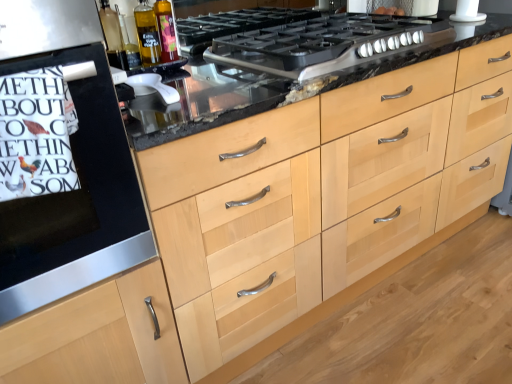
Where is `white matte plastic pipe at upper right, which ranks as the 1th appliance in back-to-front order`? This screenshot has height=384, width=512. white matte plastic pipe at upper right, which ranks as the 1th appliance in back-to-front order is located at coordinates (467, 12).

Describe the element at coordinates (166, 31) in the screenshot. I see `translucent glass bottle at upper left, which is the first bottle from right to left` at that location.

Describe the element at coordinates (147, 34) in the screenshot. I see `translucent glass bottle at upper center, the first bottle in the left-to-right sequence` at that location.

Identify the location of black matte oven at left. The height and width of the screenshot is (384, 512). (62, 159).

Identify the location of white matte plastic pipe at upper right, the 2th appliance positioned from the bottom. (467, 12).

Does translucent glass bottle at upper left, the second bottle in the left-to-right sequence, turn towards white plastic juicer at center, the first appliance in the front-to-back sequence?

No, translucent glass bottle at upper left, the second bottle in the left-to-right sequence, is not aimed at white plastic juicer at center, the first appliance in the front-to-back sequence.

Is point (170, 26) closer to camera compared to point (137, 96)?

No, (170, 26) is further to viewer.

Find the location of a particular element. appliance below the translucent glass bottle at upper left, which is the first bottle from right to left (from a real-world perspective) is located at coordinates (x=153, y=87).

Considering their positions, is translucent glass bottle at upper left, the second bottle in the left-to-right sequence, located in front of or behind white plastic juicer at center, which appears as the second appliance when viewed from the top?

Clearly, translucent glass bottle at upper left, the second bottle in the left-to-right sequence, is behind white plastic juicer at center, which appears as the second appliance when viewed from the top.

Does point (38, 188) come in front of point (158, 37)?

Yes, point (38, 188) is closer to viewer.

Is white paper towel at left spatially inside translucent glass bottle at upper center, which appears as the 2th bottle when viewed from the right, or outside of it?

white paper towel at left exists outside the volume of translucent glass bottle at upper center, which appears as the 2th bottle when viewed from the right.

From the image's perspective, is white paper towel at left on translucent glass bottle at upper center, the first bottle in the left-to-right sequence?

Incorrect, from the image's perspective, white paper towel at left is lower than translucent glass bottle at upper center, the first bottle in the left-to-right sequence.

Based on the photo, can you tell me how much translucent glass bottle at upper center, which appears as the 2th bottle when viewed from the right, and white matte plastic pipe at upper right, which is the 2th appliance in left-to-right order, differ in facing direction?

The angle between the facing direction of translucent glass bottle at upper center, which appears as the 2th bottle when viewed from the right, and the facing direction of white matte plastic pipe at upper right, which is the 2th appliance in left-to-right order, is 0.134 degrees.

Does translucent glass bottle at upper center, which appears as the 2th bottle when viewed from the right, appear on the right side of white matte plastic pipe at upper right, which is counted as the 2th appliance, starting from the front?

No.

From the image's perspective, between translucent glass bottle at upper center, the first bottle in the left-to-right sequence, and white matte plastic pipe at upper right, arranged as the first appliance when viewed from the right, who is located below?

translucent glass bottle at upper center, the first bottle in the left-to-right sequence, is shown below in the image.

Which of these two, translucent glass bottle at upper center, the first bottle in the left-to-right sequence, or white matte plastic pipe at upper right, which ranks as the 1th appliance in back-to-front order, is wider?

white matte plastic pipe at upper right, which ranks as the 1th appliance in back-to-front order, is wider.

Which of these two, white matte plastic pipe at upper right, positioned as the first appliance in top-to-bottom order, or black matte gas stove at center, is bigger?

Answer: black matte gas stove at center is bigger.

Considering the sizes of white matte plastic pipe at upper right, which is counted as the 2th appliance, starting from the front, and black matte gas stove at center in the image, is white matte plastic pipe at upper right, which is counted as the 2th appliance, starting from the front, wider or thinner than black matte gas stove at center?

Considering their sizes, white matte plastic pipe at upper right, which is counted as the 2th appliance, starting from the front, looks slimmer than black matte gas stove at center.

Visually, is white matte plastic pipe at upper right, positioned as the first appliance in top-to-bottom order, positioned to the left or to the right of black matte gas stove at center?

From the image, it's evident that white matte plastic pipe at upper right, positioned as the first appliance in top-to-bottom order, is to the right of black matte gas stove at center.

Considering the points (485, 16) and (273, 49), which point is in front, point (485, 16) or point (273, 49)?

The point (273, 49) is more forward.

Which object is thinner, black matte gas stove at center or white paper towel at left?

white paper towel at left.

From the image's perspective, is black matte gas stove at center beneath white paper towel at left?

No.

Considering the positions of points (337, 41) and (68, 104), is point (337, 41) farther from camera compared to point (68, 104)?

Yes, point (337, 41) is farther from viewer.

Which is behind, black matte gas stove at center or white paper towel at left?

black matte gas stove at center is behind.

Based on the photo, is white matte plastic pipe at upper right, which is the 2th appliance in left-to-right order, not within translucent glass bottle at upper center, which appears as the 2th bottle when viewed from the right?

Indeed, white matte plastic pipe at upper right, which is the 2th appliance in left-to-right order, is completely outside translucent glass bottle at upper center, which appears as the 2th bottle when viewed from the right.

Who is more distant, white matte plastic pipe at upper right, positioned as the first appliance in top-to-bottom order, or translucent glass bottle at upper center, which appears as the 2th bottle when viewed from the right?

Positioned behind is white matte plastic pipe at upper right, positioned as the first appliance in top-to-bottom order.

Which object is thinner, white matte plastic pipe at upper right, which is the 2th appliance in left-to-right order, or translucent glass bottle at upper center, which appears as the 2th bottle when viewed from the right?

translucent glass bottle at upper center, which appears as the 2th bottle when viewed from the right, is thinner.

Can you confirm if white matte plastic pipe at upper right, which is the 2th appliance in left-to-right order, is shorter than translucent glass bottle at upper center, the first bottle in the left-to-right sequence?

No, white matte plastic pipe at upper right, which is the 2th appliance in left-to-right order, is not shorter than translucent glass bottle at upper center, the first bottle in the left-to-right sequence.

Is black matte oven at left looking in the opposite direction of black matte gas stove at center?

No, black matte oven at left is not facing away from black matte gas stove at center.

Can you tell me how much black matte oven at left and black matte gas stove at center differ in facing direction?

0.000116 degrees.

Between black matte oven at left and black matte gas stove at center, which one appears on the left side from the viewer's perspective?

Positioned to the left is black matte oven at left.

In terms of height, does black matte oven at left look taller or shorter compared to black matte gas stove at center?

Clearly, black matte oven at left is taller compared to black matte gas stove at center.

Where is `appliance in front of the translucent glass bottle at upper left, which is the first bottle from right to left`? Image resolution: width=512 pixels, height=384 pixels. appliance in front of the translucent glass bottle at upper left, which is the first bottle from right to left is located at coordinates (153, 87).

Find the location of a particular element. the 2nd bottle located above the white paper towel at left (from a real-world perspective) is located at coordinates (147, 34).

Which object lies further to the anchor point white paper towel at left, translucent glass bottle at upper center, the first bottle in the left-to-right sequence, or black matte gas stove at center?

black matte gas stove at center lies further to white paper towel at left than the other object.

Which object lies nearer to the anchor point black matte oven at left, translucent glass bottle at upper left, which is the first bottle from right to left, or white plastic juicer at center, the second appliance from the right?

Among the two, white plastic juicer at center, the second appliance from the right, is located nearer to black matte oven at left.

Looking at the image, which one is located further to black matte gas stove at center, white paper towel at left or white plastic juicer at center, positioned as the first appliance in bottom-to-top order?

The object further to black matte gas stove at center is white paper towel at left.

Which object lies nearer to the anchor point white matte plastic pipe at upper right, which is the 2th appliance in left-to-right order, translucent glass bottle at upper center, the first bottle in the left-to-right sequence, or black matte gas stove at center?

Based on the image, black matte gas stove at center appears to be nearer to white matte plastic pipe at upper right, which is the 2th appliance in left-to-right order.

Considering their positions, is white plastic juicer at center, which appears as the second appliance when viewed from the top, positioned closer to white paper towel at left than black matte gas stove at center?

white plastic juicer at center, which appears as the second appliance when viewed from the top, lies closer to white paper towel at left than the other object.

Which object lies further to the anchor point black matte gas stove at center, white matte plastic pipe at upper right, the 2th appliance positioned from the bottom, or white plastic juicer at center, the second appliance from the right?

Based on the image, white plastic juicer at center, the second appliance from the right, appears to be further to black matte gas stove at center.

Based on their spatial positions, is translucent glass bottle at upper left, the second bottle in the left-to-right sequence, or black matte oven at left closer to white paper towel at left?

Based on the image, black matte oven at left appears to be nearer to white paper towel at left.

Considering their positions, is white matte plastic pipe at upper right, the 2th appliance positioned from the bottom, positioned further to translucent glass bottle at upper left, which is the first bottle from right to left, than translucent glass bottle at upper center, which appears as the 2th bottle when viewed from the right?

Among the two, white matte plastic pipe at upper right, the 2th appliance positioned from the bottom, is located further to translucent glass bottle at upper left, which is the first bottle from right to left.

Image resolution: width=512 pixels, height=384 pixels. I want to click on appliance located between white paper towel at left and white matte plastic pipe at upper right, which ranks as the 1th appliance in back-to-front order, in the left-right direction, so click(x=153, y=87).

Find the location of a particular element. The image size is (512, 384). appliance between black matte oven at left and white matte plastic pipe at upper right, positioned as the first appliance in top-to-bottom order, in the horizontal direction is located at coordinates (153, 87).

Where is `appliance between translucent glass bottle at upper left, the second bottle in the left-to-right sequence, and white matte plastic pipe at upper right, arranged as the first appliance when viewed from the right, from left to right`? The width and height of the screenshot is (512, 384). appliance between translucent glass bottle at upper left, the second bottle in the left-to-right sequence, and white matte plastic pipe at upper right, arranged as the first appliance when viewed from the right, from left to right is located at coordinates (153, 87).

Locate an element on the screen. Image resolution: width=512 pixels, height=384 pixels. appliance between translucent glass bottle at upper center, which appears as the 2th bottle when viewed from the right, and white matte plastic pipe at upper right, which ranks as the 1th appliance in back-to-front order, from left to right is located at coordinates (153, 87).